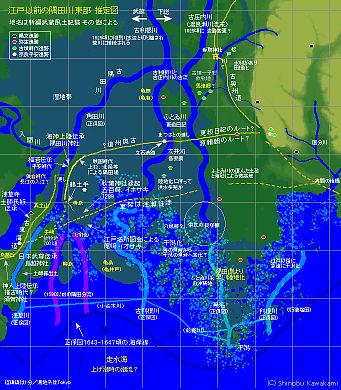
Identify the location of map. (159, 327).